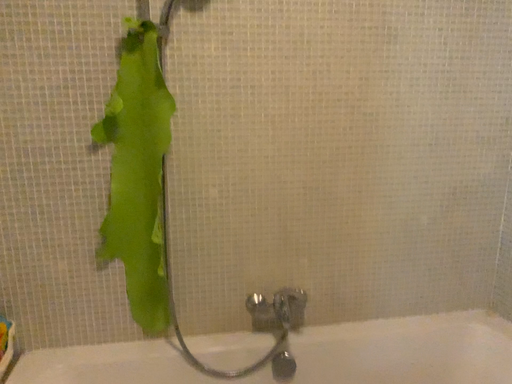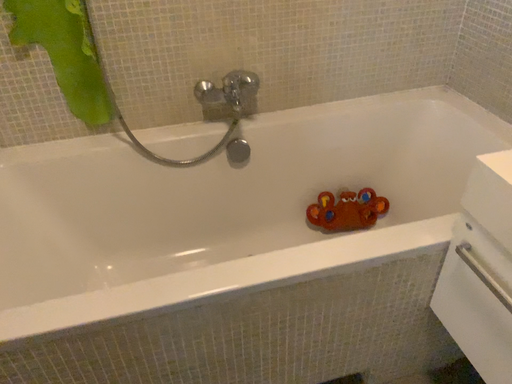
Question: Which way did the camera rotate in the video?

Choices:
 (A) rotated upward
 (B) rotated downward

Answer: (B)